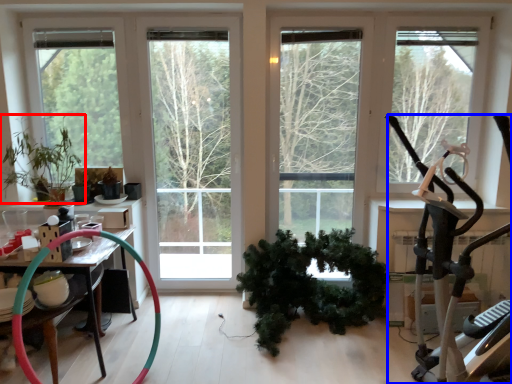
Question: Which object is further to the camera taking this photo, houseplant (highlighted by a red box) or stationary bicycle (highlighted by a blue box)?

Choices:
 (A) houseplant
 (B) stationary bicycle

Answer: (A)